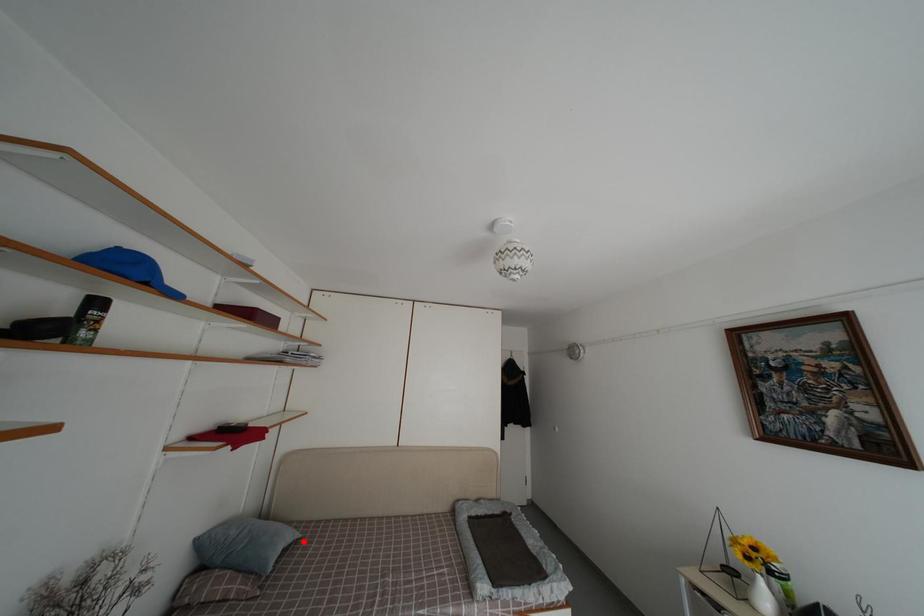
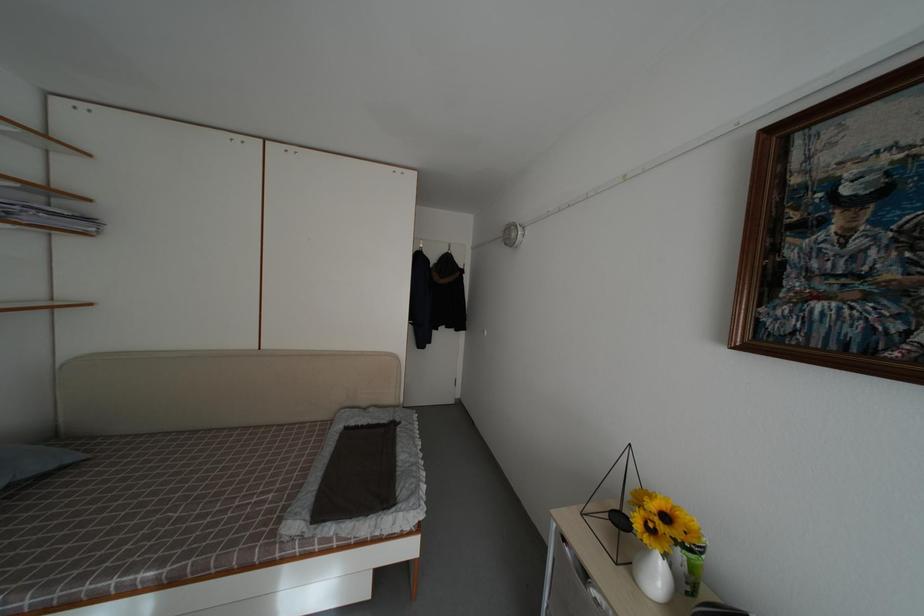
The point at the highlighted location is marked in the first image. Where is the corresponding point in the second image?

(80, 464)